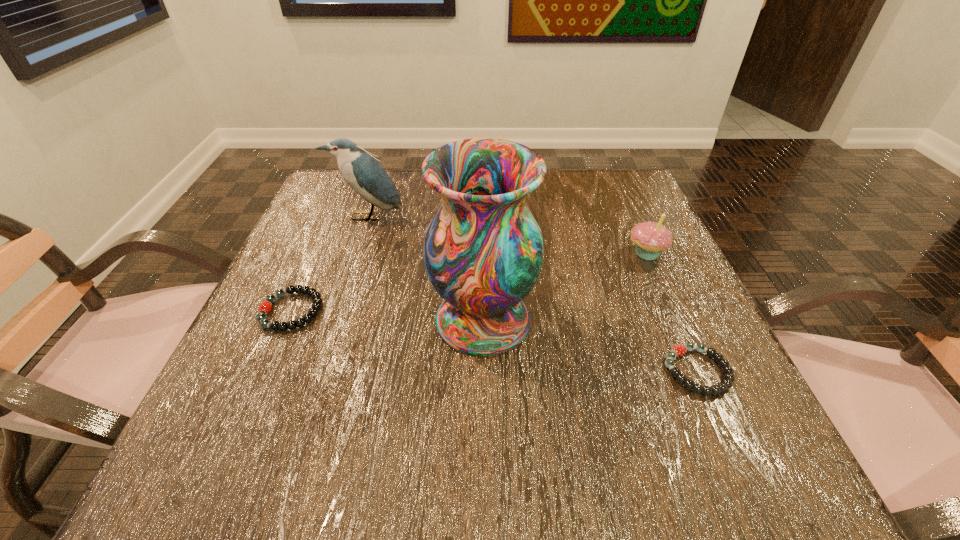
I want to click on free region at the near edge, so point(510,458).

At what (x,y) coordinates should I click in order to perform the action: click on vacant space at the left edge of the desktop. Please return your answer as a coordinate pair (x, y). The height and width of the screenshot is (540, 960). Looking at the image, I should click on (364, 251).

This screenshot has width=960, height=540. Identify the location of vacant space at the right edge of the desktop. (689, 420).

Where is `free space at the far left corner of the desktop`? free space at the far left corner of the desktop is located at coordinates (338, 212).

In order to click on vacant space at the near left corner in this screenshot , I will do `click(236, 483)`.

Where is `vacant space at the far right corner`? Image resolution: width=960 pixels, height=540 pixels. vacant space at the far right corner is located at coordinates (635, 202).

Where is `vacant area that lies between the nearer bracelet and the vase`? This screenshot has height=540, width=960. vacant area that lies between the nearer bracelet and the vase is located at coordinates (590, 346).

You are a GUI agent. You are given a task and a screenshot of the screen. Output one action in this format:
    pyautogui.click(x=<x>, y=<y>)
    Task: Click on the vacant area that lies between the second farthest object and the right bracelet
    
    Given the screenshot: What is the action you would take?
    pyautogui.click(x=672, y=312)

Image resolution: width=960 pixels, height=540 pixels. I want to click on vacant area that lies between the right bracelet and the tallest object, so (x=590, y=346).

Locate an element on the screen. This screenshot has height=540, width=960. free spot between the farthest object and the left bracelet is located at coordinates (329, 264).